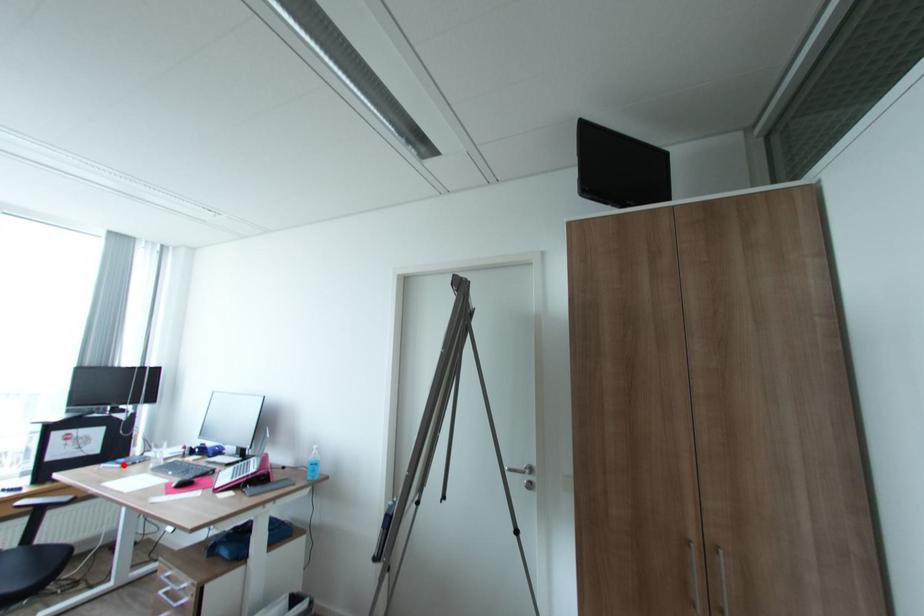
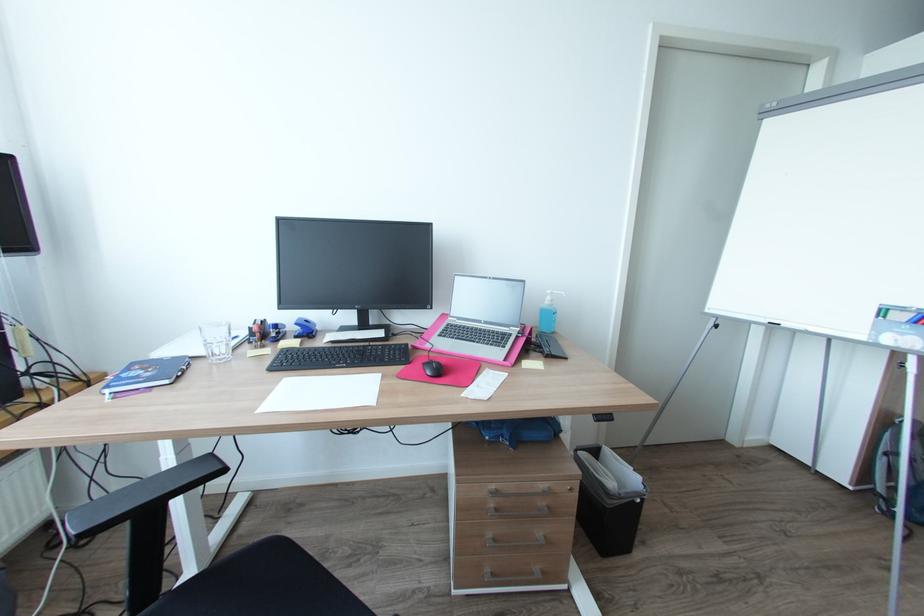
Where in the second image is the point corresponding to the highlighted location from the first image?

(171, 381)